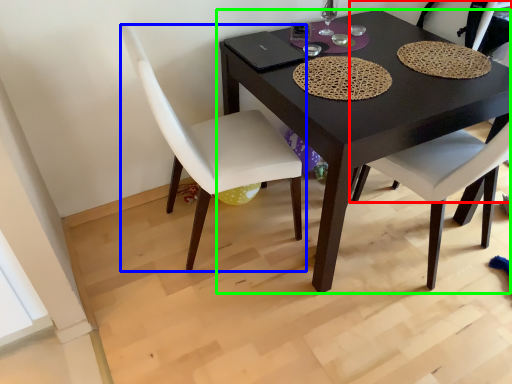
Question: Which is farther away from chair (highlighted by a red box)? chair (highlighted by a blue box) or table (highlighted by a green box)?

Choices:
 (A) chair
 (B) table

Answer: (A)